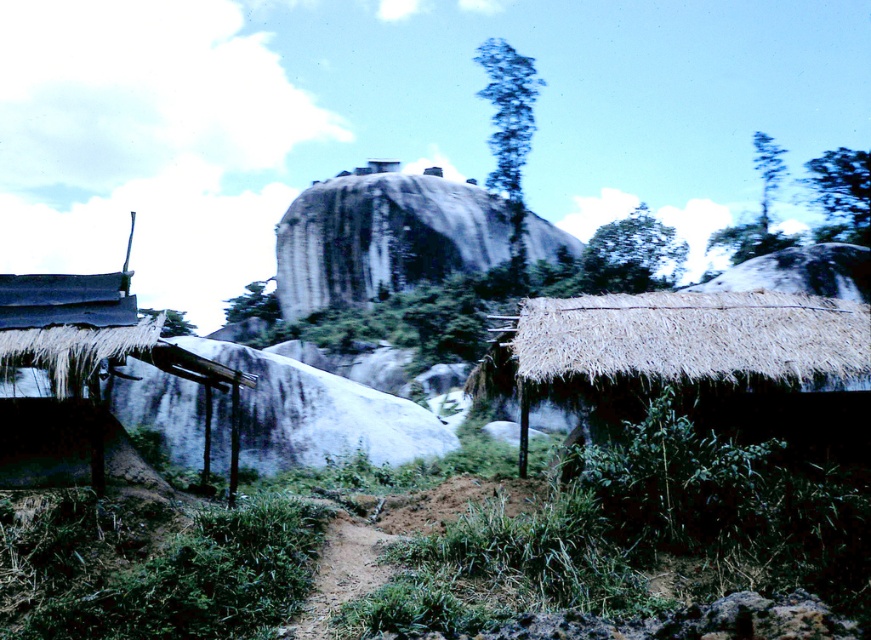
Question: Is thatched straw hut at lower right above rough stone mountain at center?

Choices:
 (A) no
 (B) yes

Answer: (A)

Question: Which object is positioned farthest from the thatched straw hut at lower right?

Choices:
 (A) dark gray thatched roof at left
 (B) rough stone mountain at center

Answer: (B)

Question: Can you confirm if thatched straw hut at lower right is smaller than rough stone mountain at center?

Choices:
 (A) yes
 (B) no

Answer: (A)

Question: Which point is closer to the camera?

Choices:
 (A) thatched straw hut at lower right
 (B) dark gray thatched roof at left

Answer: (B)

Question: Can you confirm if thatched straw hut at lower right is wider than dark gray thatched roof at left?

Choices:
 (A) yes
 (B) no

Answer: (A)

Question: Which of the following is the closest to the observer?

Choices:
 (A) (446, 218)
 (B) (100, 442)
 (C) (821, 314)

Answer: (B)